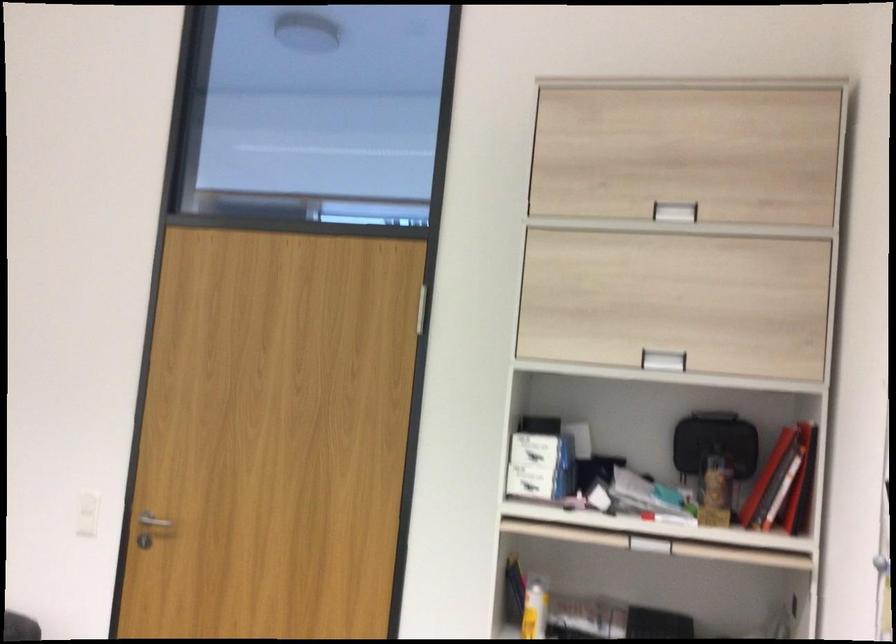
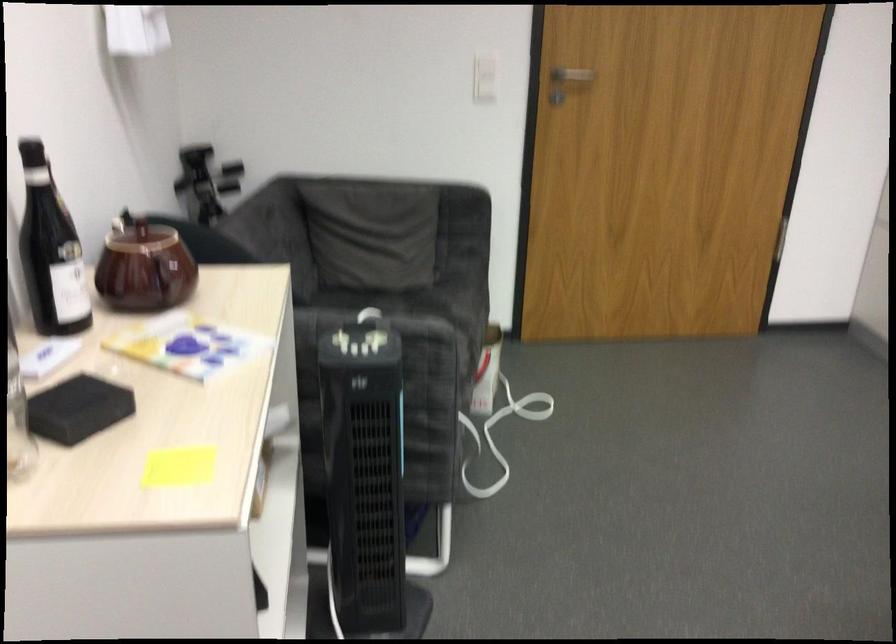
The point at (149, 527) is marked in the first image. Where is the corresponding point in the second image?

(569, 77)